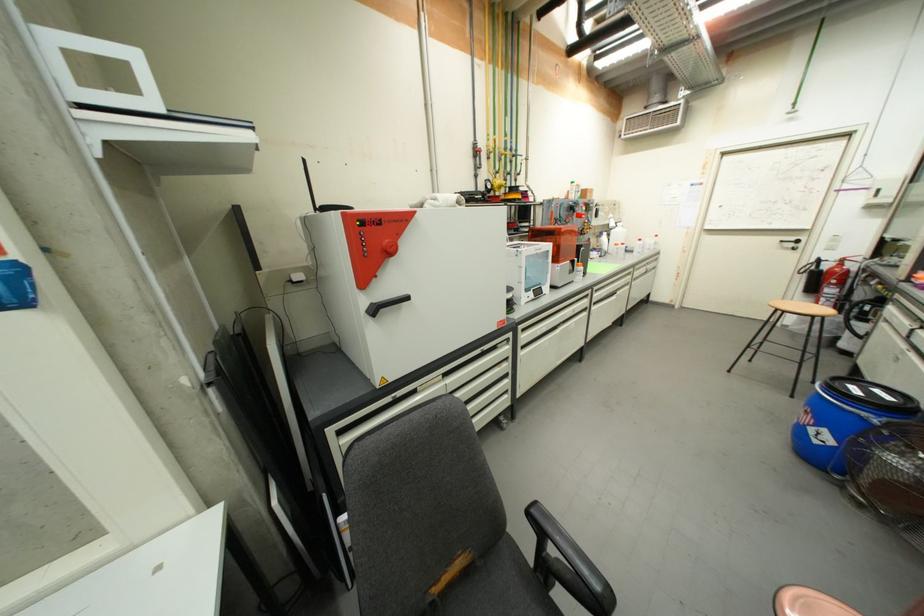
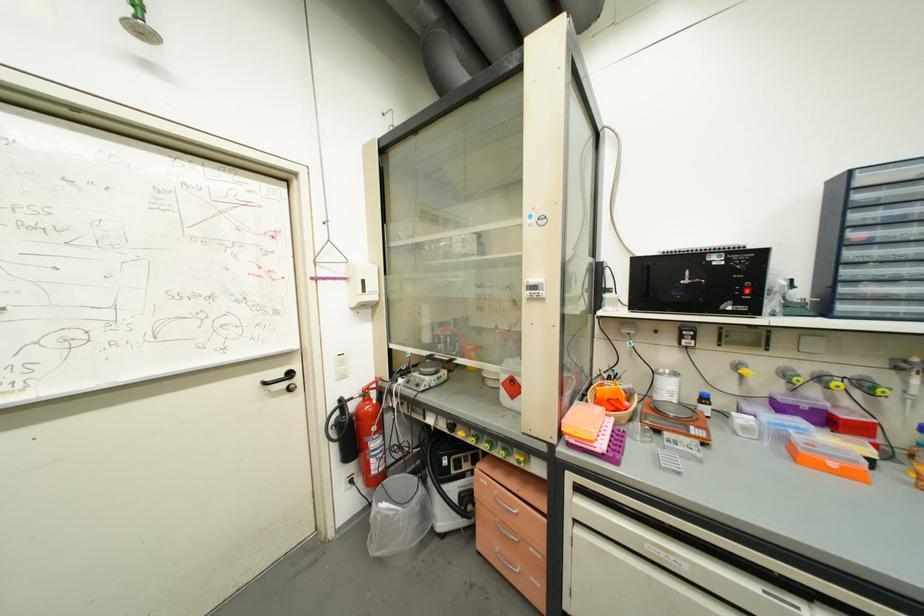
Locate, in the second image, the point that corresponds to pixel 796 253 in the first image.

(293, 398)